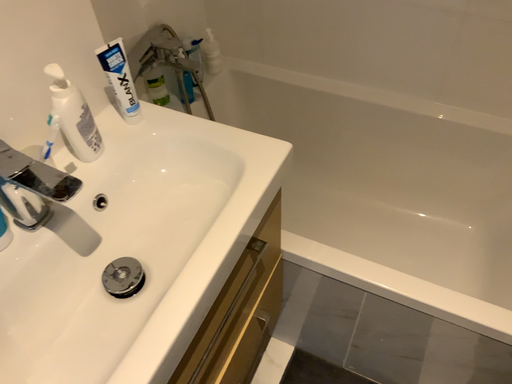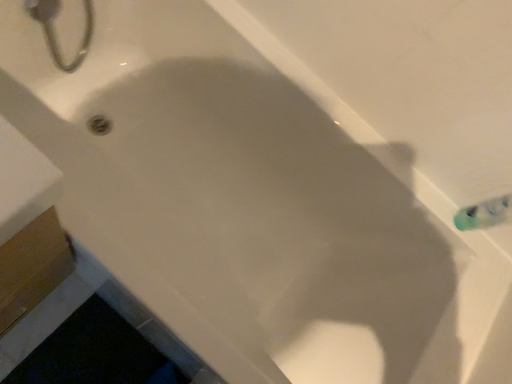
Question: How did the camera likely rotate when shooting the video?

Choices:
 (A) rotated upward
 (B) rotated downward

Answer: (B)